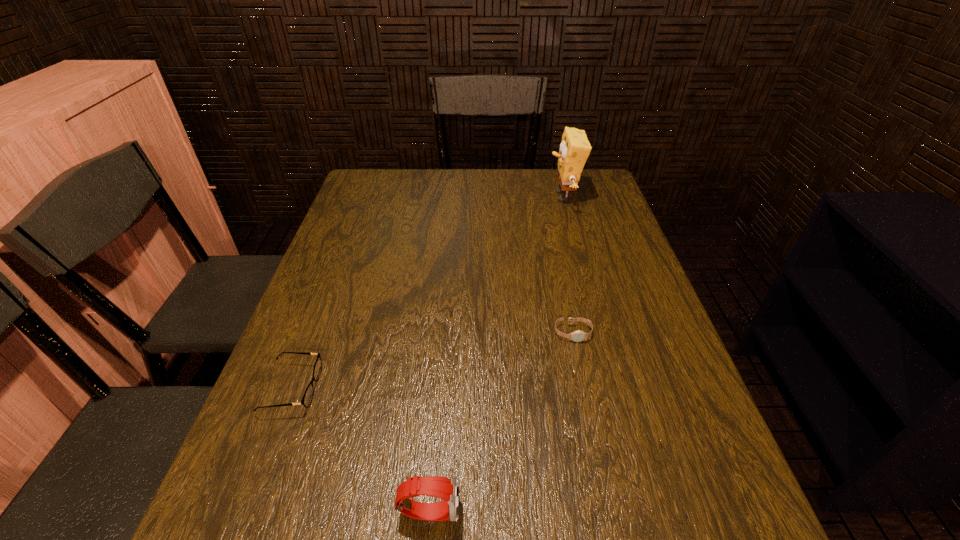
This screenshot has height=540, width=960. Identify the location of free space that satisfies the following two spatial constraints: 1. on the face of the tallest object; 2. on the face of the farther watch. (601, 333).

The image size is (960, 540). Identify the location of vacant region that satisfies the following two spatial constraints: 1. on the face of the shorter watch; 2. on the front-facing side of the spectacles. (585, 388).